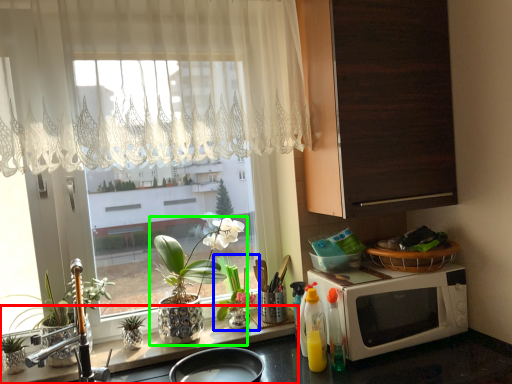
Question: Estimate the real-world distances between objects in this image. Which object is farther from counter top (highlighted by a red box), houseplant (highlighted by a blue box) or houseplant (highlighted by a green box)?

Choices:
 (A) houseplant
 (B) houseplant

Answer: (A)